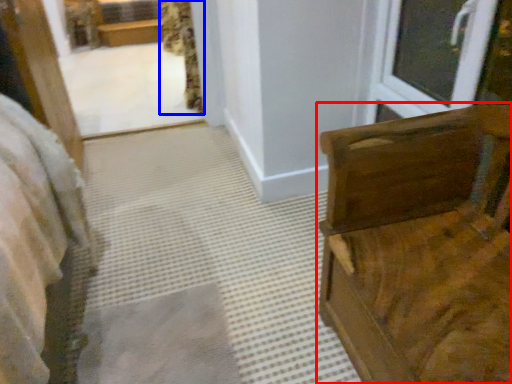
Question: Which object appears closest to the camera in this image, furniture (highlighted by a red box) or curtain (highlighted by a blue box)?

Choices:
 (A) furniture
 (B) curtain

Answer: (A)